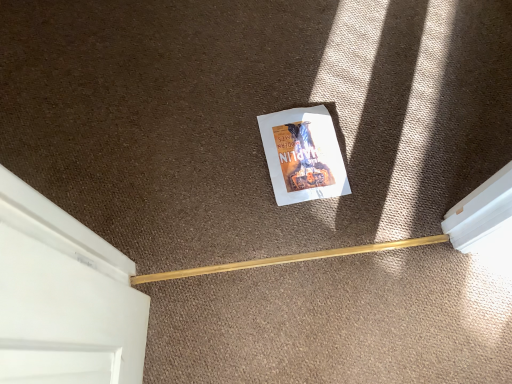
Where is `free point above matte paper book at center (from a real-world perspective)`? free point above matte paper book at center (from a real-world perspective) is located at coordinates (304, 153).